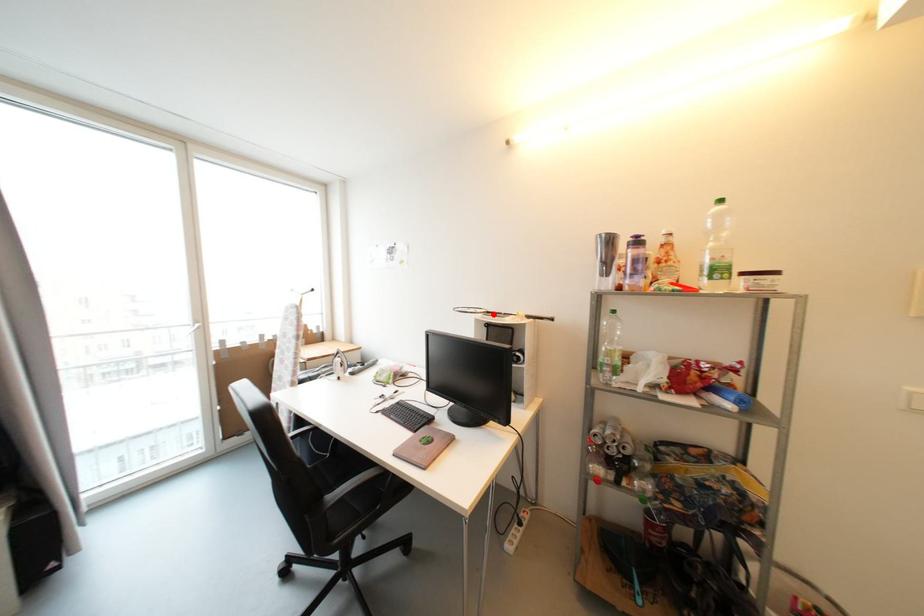
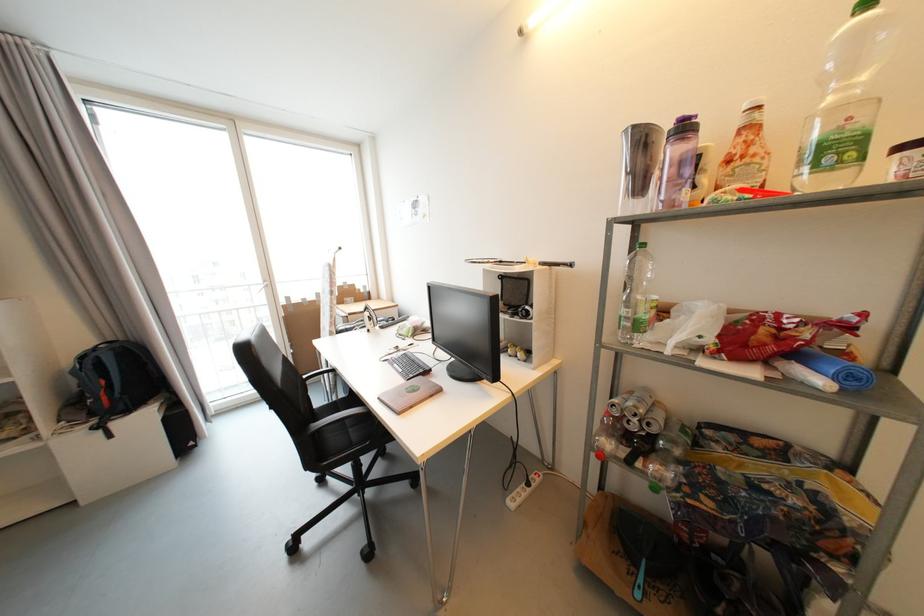
In the second image, find the point that corresponds to the highlighted location in the first image.

(505, 264)